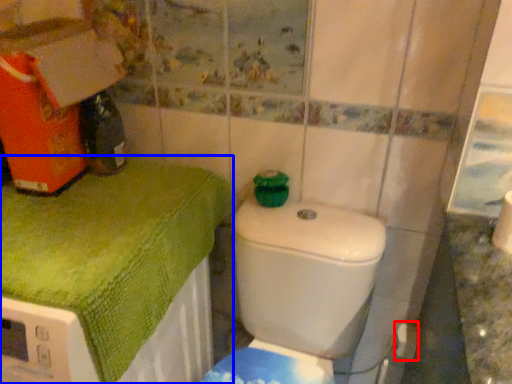
Question: Among these objects, which one is nearest to the camera, toilet paper (highlighted by a red box) or bath towel (highlighted by a blue box)?

Choices:
 (A) toilet paper
 (B) bath towel

Answer: (B)